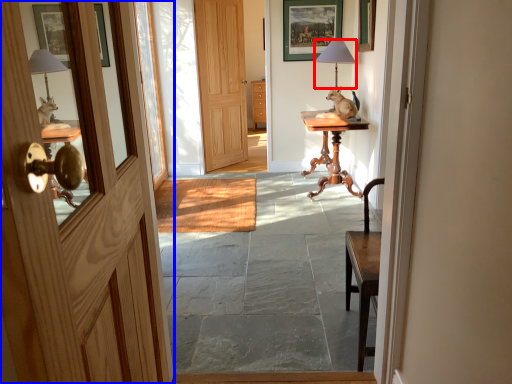
Question: Which object is closer to the camera taking this photo, table lamp (highlighted by a red box) or door (highlighted by a blue box)?

Choices:
 (A) table lamp
 (B) door

Answer: (B)